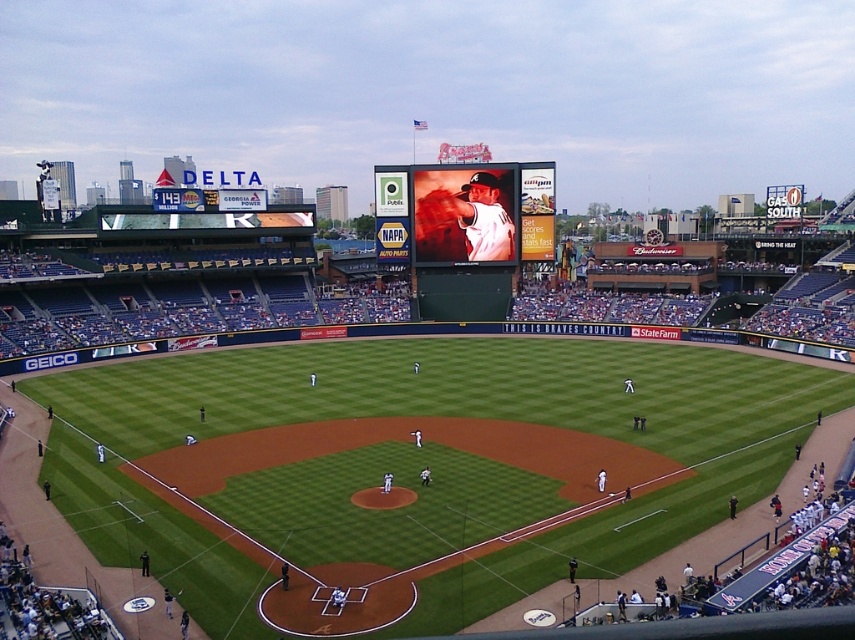
What do you see at coordinates (458, 234) in the screenshot? I see `matte black scoreboard at center` at bounding box center [458, 234].

Between matte black scoreboard at center and matte white baseball player at center, which one is positioned higher?

matte white baseball player at center is above.

Identify the location of matte black scoreboard at center. The width and height of the screenshot is (855, 640). (458, 234).